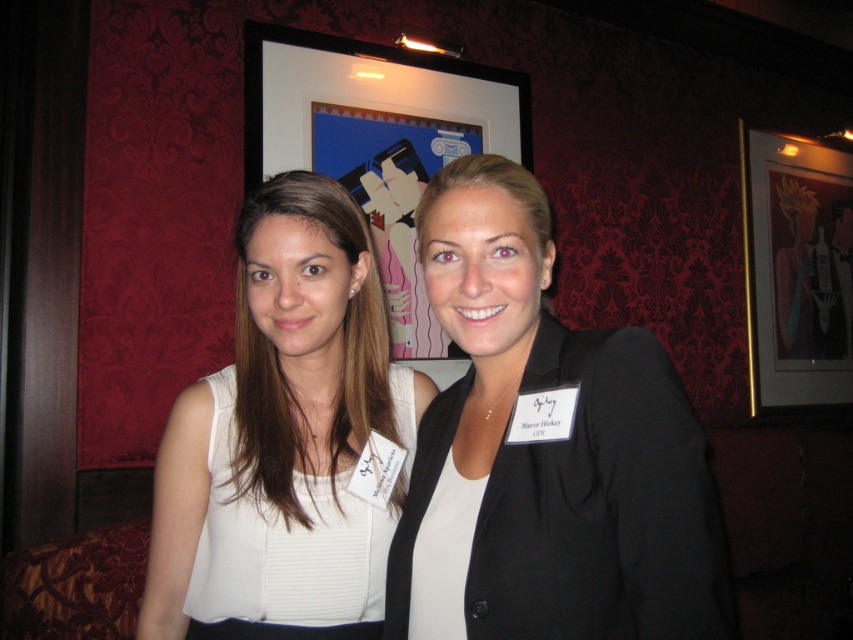
Consider the image. Looking at the scene described, which object is positioned to the left of the other between the black matte blazer at center and the black framed picture at upper center?

The black framed picture at upper center is to the left of the black matte blazer at center.

You are a photographer at a formal event. You need to position a spotlight exactly at point [546,452] to highlight an object in the image. According to the scene description, which object should the spotlight illuminate?

The point [546,452] marks the black matte blazer at center, so the spotlight should illuminate the black matte blazer at center.

You are at a formal event and want to take a photo of the white matte dress at center without including the black framed picture at upper center in the shot. How should you adjust your camera angle?

To avoid capturing the black framed picture at upper center, position the camera lower so that the white matte dress at center is framed below it.